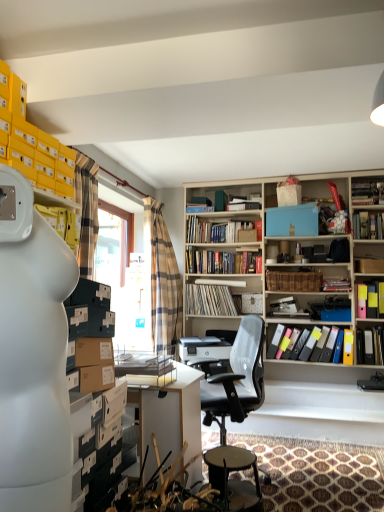
This screenshot has height=512, width=384. What do you see at coordinates (34, 143) in the screenshot?
I see `yellow cardboard boxes at upper left` at bounding box center [34, 143].

The height and width of the screenshot is (512, 384). I want to click on hardcover book at upper right, the tenth book when ordered from bottom to top, so click(x=367, y=191).

I want to click on plaid fabric curtain at center, so click(162, 280).

Identify the location of multicolored file folders at upper right, which ranks as the fourth book in bottom-to-top order. The height and width of the screenshot is (512, 384). (367, 301).

Identify the location of hardcover books at center, positioned as the 6th book in bottom-to-top order. (223, 261).

Image resolution: width=384 pixels, height=512 pixels. In order to click on hardcover book at upper right, the eighth book from the bottom in this screenshot , I will do `click(368, 225)`.

Image resolution: width=384 pixels, height=512 pixels. I want to click on yellow cardboard boxes at upper left, so click(34, 143).

Do you think black leather bar stool at center is within hardcover books at center, positioned as the 6th book in bottom-to-top order, or outside of it?

black leather bar stool at center is located beyond the bounds of hardcover books at center, positioned as the 6th book in bottom-to-top order.

Between point (230, 470) and point (242, 257), which one is positioned behind?

The point (242, 257) is farther from the camera.

Is black leather bar stool at center closer to the viewer compared to hardcover books at center, which is the 5th book in top-to-bottom order?

Yes, it is.

Looking at their sizes, would you say black leather bar stool at center is wider or thinner than hardcover books at center, which is the 5th book in top-to-bottom order?

Considering their sizes, black leather bar stool at center looks broader than hardcover books at center, which is the 5th book in top-to-bottom order.

Is black mesh office chair at center taller than yellow file folder at right, which ranks as the ninth book in top-to-bottom order?

Correct, black mesh office chair at center is much taller as yellow file folder at right, which ranks as the ninth book in top-to-bottom order.

Considering the points (206, 420) and (377, 337), which point is in front, point (206, 420) or point (377, 337)?

The point (206, 420) is more forward.

Is black mesh office chair at center outside of yellow file folder at right, which ranks as the ninth book in top-to-bottom order?

Absolutely, black mesh office chair at center is external to yellow file folder at right, which ranks as the ninth book in top-to-bottom order.

Is black mesh office chair at center oriented away from yellow file folder at right, which ranks as the ninth book in top-to-bottom order?

Correct, black mesh office chair at center is looking away from yellow file folder at right, which ranks as the ninth book in top-to-bottom order.

From a real-world perspective, is matte black book at upper center, which appears as the sixth book when viewed from the top, physically below hardcover books at center, which is the 5th book in top-to-bottom order?

Yes.

Measure the distance from matte black book at upper center, the fifth book in the bottom-to-top sequence, to hardcover books at center, positioned as the 6th book in bottom-to-top order.

matte black book at upper center, the fifth book in the bottom-to-top sequence, and hardcover books at center, positioned as the 6th book in bottom-to-top order, are 38.08 inches apart.

Is point (330, 291) in front of point (199, 254)?

Yes.

Which is more to the right, matte black book at upper center, the fifth book in the bottom-to-top sequence, or hardcover books at center, positioned as the 6th book in bottom-to-top order?

Positioned to the right is matte black book at upper center, the fifth book in the bottom-to-top sequence.

The width and height of the screenshot is (384, 512). Find the location of `bar stool in front of the white vinyl records at center, positioned as the eighth book in top-to-bottom order`. bar stool in front of the white vinyl records at center, positioned as the eighth book in top-to-bottom order is located at coordinates (234, 480).

In terms of width, does white vinyl records at center, positioned as the eighth book in top-to-bottom order, look wider or thinner when compared to black leather bar stool at center?

Clearly, white vinyl records at center, positioned as the eighth book in top-to-bottom order, has less width compared to black leather bar stool at center.

Is white vinyl records at center, which is the third book from bottom to top, aimed at black leather bar stool at center?

No.

From the picture: Considering the sizes of objects white vinyl records at center, positioned as the eighth book in top-to-bottom order, and black leather bar stool at center in the image provided, who is smaller, white vinyl records at center, positioned as the eighth book in top-to-bottom order, or black leather bar stool at center?

white vinyl records at center, positioned as the eighth book in top-to-bottom order, is smaller.

Considering the sizes of objects matte black book at upper center, the fifth book in the bottom-to-top sequence, and blue matte box at upper center in the image provided, who is bigger, matte black book at upper center, the fifth book in the bottom-to-top sequence, or blue matte box at upper center?

blue matte box at upper center is bigger.

Considering the positions of objects matte black book at upper center, the fifth book in the bottom-to-top sequence, and blue matte box at upper center in the image provided, who is more to the right, matte black book at upper center, the fifth book in the bottom-to-top sequence, or blue matte box at upper center?

Positioned to the right is matte black book at upper center, the fifth book in the bottom-to-top sequence.

Is matte black book at upper center, which appears as the sixth book when viewed from the top, taller or shorter than blue matte box at upper center?

Considering their sizes, matte black book at upper center, which appears as the sixth book when viewed from the top, has less height than blue matte box at upper center.

In the scene shown: Between matte black book at upper center, the fifth book in the bottom-to-top sequence, and blue matte box at upper center, which one is positioned in front?

matte black book at upper center, the fifth book in the bottom-to-top sequence, is in front.

Which is behind, point (323, 289) or point (215, 303)?

The point (215, 303) is more distant.

Is matte black book at upper center, which appears as the sixth book when viewed from the top, turned away from white vinyl records at center, which is the third book from bottom to top?

No, matte black book at upper center, which appears as the sixth book when viewed from the top, is not facing away from white vinyl records at center, which is the third book from bottom to top.

Can you confirm if matte black book at upper center, the fifth book in the bottom-to-top sequence, is thinner than white vinyl records at center, which is the third book from bottom to top?

Indeed, matte black book at upper center, the fifth book in the bottom-to-top sequence, has a lesser width compared to white vinyl records at center, which is the third book from bottom to top.

Is matte black book at upper center, which appears as the sixth book when viewed from the top, outside of white vinyl records at center, which is the third book from bottom to top?

Absolutely, matte black book at upper center, which appears as the sixth book when viewed from the top, is external to white vinyl records at center, which is the third book from bottom to top.

Is transparent plastic window screen at center taller or shorter than multicolored file folders at upper right, which is counted as the seventh book, starting from the top?

Clearly, transparent plastic window screen at center is taller compared to multicolored file folders at upper right, which is counted as the seventh book, starting from the top.

Which of these two, transparent plastic window screen at center or multicolored file folders at upper right, which ranks as the fourth book in bottom-to-top order, is thinner?

With smaller width is transparent plastic window screen at center.

Is transparent plastic window screen at center closer to the viewer compared to multicolored file folders at upper right, which ranks as the fourth book in bottom-to-top order?

Yes, transparent plastic window screen at center is closer to the camera.

You are a GUI agent. You are given a task and a screenshot of the screen. Output one action in this format:
    pyautogui.click(x=<x>, y=<y>)
    Task: Click on the window screen above the multicolored file folders at upper right, which ranks as the fourth book in bottom-to-top order (from the image's perspective)
    The image size is (384, 512).
    Given the screenshot: What is the action you would take?
    pyautogui.click(x=124, y=281)

From the image's perspective, starting from the black leather bar stool at center, which book is the 6th one above? Please provide its 2D coordinates.

[(223, 261)]

This screenshot has width=384, height=512. What are the coordinates of `book that is the 6th object to the right of the black mesh office chair at center, starting at the anchor` in the screenshot? It's located at (370, 346).

When comparing their distances from yellow cardboard boxes at upper left, does multicolored file folders at upper right, which ranks as the fourth book in bottom-to-top order, or plaid fabric curtain at center seem further?

multicolored file folders at upper right, which ranks as the fourth book in bottom-to-top order, lies further to yellow cardboard boxes at upper left than the other object.

Considering their positions, is yellow cardboard boxes at upper left positioned closer to blue matte box at upper center than blue cardboard box at upper center, which is counted as the 2th book, starting from the top?

Based on the image, blue cardboard box at upper center, which is counted as the 2th book, starting from the top, appears to be nearer to blue matte box at upper center.

When comparing their distances from hardcover book at upper right, the eighth book from the bottom, does multicolored file folders at upper right, which ranks as the fourth book in bottom-to-top order, or hardcover books at center, placed as the seventh book when sorted from bottom to top, seem closer?

Based on the image, multicolored file folders at upper right, which ranks as the fourth book in bottom-to-top order, appears to be nearer to hardcover book at upper right, the eighth book from the bottom.

From the image, which object appears to be farther from black mesh office chair at center, white vinyl records at center, which is the third book from bottom to top, or hardcover books at center, the 4th book when ordered from top to bottom?

The object further to black mesh office chair at center is hardcover books at center, the 4th book when ordered from top to bottom.

Looking at the image, which one is located closer to transparent plastic window screen at center, plaid fabric curtain at center or yellow cardboard boxes at upper left?

Among the two, plaid fabric curtain at center is located nearer to transparent plastic window screen at center.

Estimate the real-world distances between objects in this image. Which object is closer to hardcover books at center, placed as the seventh book when sorted from bottom to top, multicolored plastic folders at center right, which is the tenth book in top-to-bottom order, or plaid fabric curtain at center?

The object closer to hardcover books at center, placed as the seventh book when sorted from bottom to top, is plaid fabric curtain at center.

Looking at the image, which one is located further to matte black book at upper center, the fifth book in the bottom-to-top sequence, blue cardboard box at upper center, which is counted as the 2th book, starting from the top, or transparent plastic window screen at center?

transparent plastic window screen at center is further to matte black book at upper center, the fifth book in the bottom-to-top sequence.

Considering their positions, is blue cardboard box at upper center, which is counted as the 2th book, starting from the top, positioned further to black leather bar stool at center than hardcover books at center, which is the 5th book in top-to-bottom order?

blue cardboard box at upper center, which is counted as the 2th book, starting from the top.

You are a GUI agent. You are given a task and a screenshot of the screen. Output one action in this format:
    pyautogui.click(x=<x>, y=<y>)
    Task: Click on the curtain located between black leather bar stool at center and blue matte box at upper center in the depth direction
    
    Given the screenshot: What is the action you would take?
    pyautogui.click(x=162, y=280)

Identify the location of paperback book located between hardcover books at center, positioned as the 6th book in bottom-to-top order, and multicolored file folders at upper right, which is counted as the seventh book, starting from the top, in the left-right direction. (292, 221).

You are a GUI agent. You are given a task and a screenshot of the screen. Output one action in this format:
    pyautogui.click(x=<x>, y=<y>)
    Task: Click on the curtain between black leather bar stool at center and matte black book at upper center, the fifth book in the bottom-to-top sequence, in the front-back direction
    This screenshot has width=384, height=512.
    Given the screenshot: What is the action you would take?
    pyautogui.click(x=162, y=280)

Locate an element on the screen. The image size is (384, 512). paperback book located between transparent plastic window screen at center and yellow file folder at right, which ranks as the ninth book in top-to-bottom order, in the left-right direction is located at coordinates (292, 221).